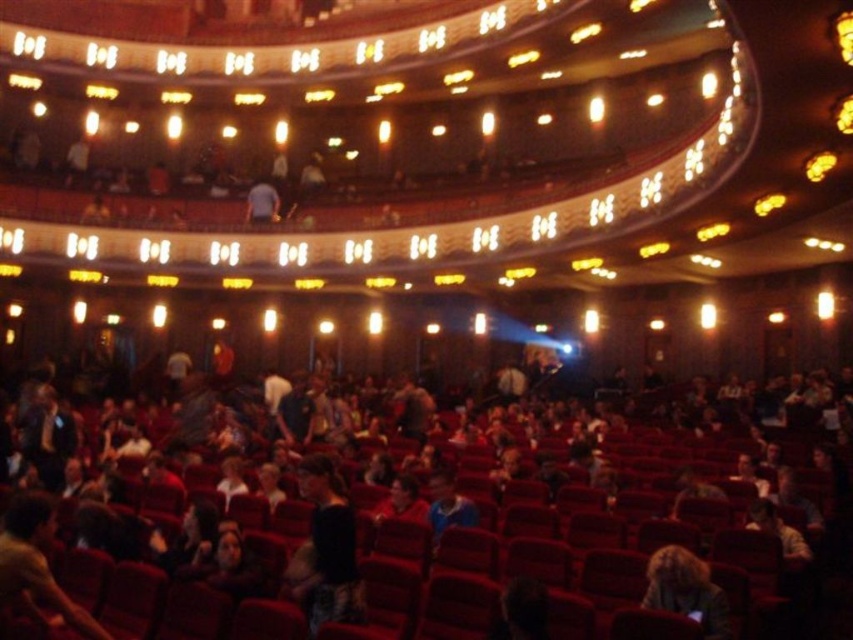
Which is more to the right, dark brown leather jacket at center or blonde hair at lower right?

blonde hair at lower right

Who is shorter, dark brown leather jacket at center or blonde hair at lower right?

With less height is blonde hair at lower right.

Measure the distance between dark brown leather jacket at center and camera.

dark brown leather jacket at center is 85.76 feet from camera.

You are a GUI agent. You are given a task and a screenshot of the screen. Output one action in this format:
    pyautogui.click(x=<x>, y=<y>)
    Task: Click on the dark brown leather jacket at center
    Image resolution: width=853 pixels, height=640 pixels.
    Given the screenshot: What is the action you would take?
    pyautogui.click(x=489, y=540)

Can you confirm if black fabric at center is bigger than blonde hair at lower right?

Correct, black fabric at center is larger in size than blonde hair at lower right.

Between point (320, 616) and point (701, 566), which one is positioned behind?

Positioned behind is point (320, 616).

Where is `black fabric at center`? The height and width of the screenshot is (640, 853). black fabric at center is located at coordinates (328, 548).

The height and width of the screenshot is (640, 853). Describe the element at coordinates (489, 540) in the screenshot. I see `dark brown leather jacket at center` at that location.

Based on the photo, which is more to the left, dark brown leather jacket at center or black fabric at center?

Positioned to the left is black fabric at center.

Does point (415, 531) come behind point (341, 544)?

That is True.

At what (x,y) coordinates should I click in order to perform the action: click on dark brown leather jacket at center. Please return your answer as a coordinate pair (x, y). Image resolution: width=853 pixels, height=640 pixels. Looking at the image, I should click on (489, 540).